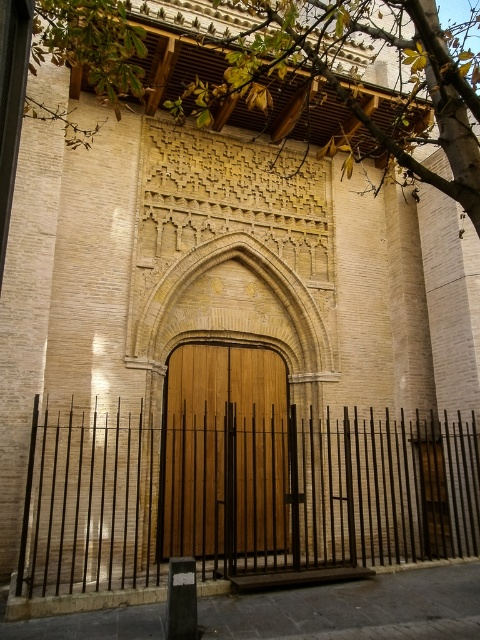
You are a painter who needs to decide which object to paint first between the black metal fence at center and the wooden door at center. Since you want to start with the wider object, which one should you choose?

The black metal fence at center is wider than the wooden door at center, so you should start painting the black metal fence at center first.

You are standing in front of the building and want to take a photo that includes both the black metal fence at center and the green leafy tree at upper center. Which object will appear larger in the photo?

The green leafy tree at upper center will appear larger in the photo because it is larger than the black metal fence at center.

You are standing in front of the building and notice the black metal fence at center and the green leafy tree at upper center. Which object is located to the left of the other?

The black metal fence at center is positioned on the left side of green leafy tree at upper center.